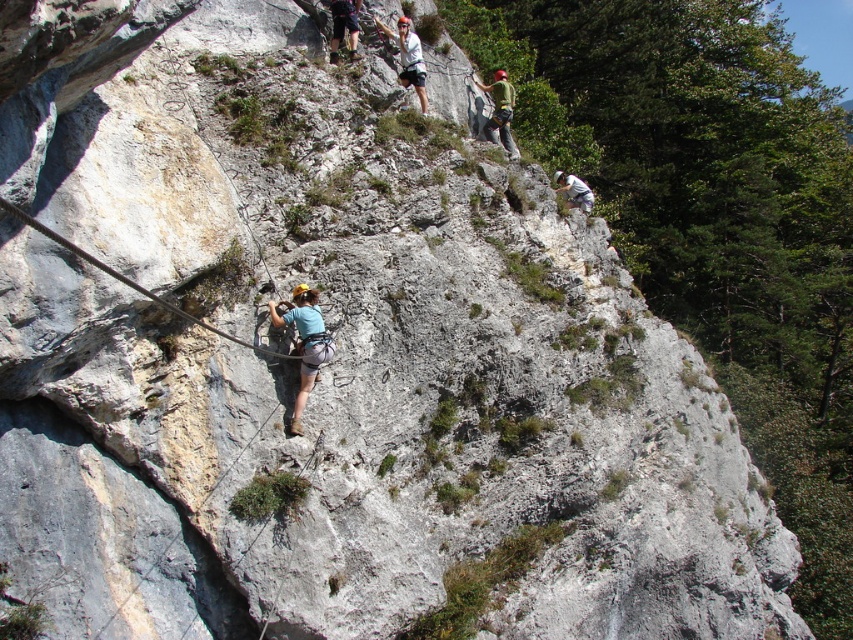
Is matte gray climbing harness at center further to the viewer compared to green fabric climbing harness at upper center?

That is False.

From the picture: Is matte gray climbing harness at center closer to camera compared to green fabric climbing harness at upper center?

Yes, it is in front of green fabric climbing harness at upper center.

The image size is (853, 640). What do you see at coordinates (305, 342) in the screenshot? I see `matte gray climbing harness at center` at bounding box center [305, 342].

The height and width of the screenshot is (640, 853). I want to click on matte gray climbing harness at center, so click(x=305, y=342).

Looking at this image, can you confirm if white matte helmet at center is shorter than green fabric climbing harness at upper center?

Indeed, white matte helmet at center has a lesser height compared to green fabric climbing harness at upper center.

Is white matte helmet at center in front of green fabric climbing harness at upper center?

Yes, white matte helmet at center is closer to the viewer.

Who is more forward, (x=410, y=83) or (x=502, y=118)?

Point (x=410, y=83) is more forward.

The image size is (853, 640). I want to click on white matte helmet at center, so click(x=408, y=58).

Can you confirm if matte gray climbing harness at center is thinner than black wire rope at center?

No.

Can you confirm if matte gray climbing harness at center is positioned to the left of black wire rope at center?

No, matte gray climbing harness at center is not to the left of black wire rope at center.

Is point (302, 296) positioned behind point (41, 227)?

That is True.

The width and height of the screenshot is (853, 640). Find the location of `matte gray climbing harness at center`. matte gray climbing harness at center is located at coordinates (305, 342).